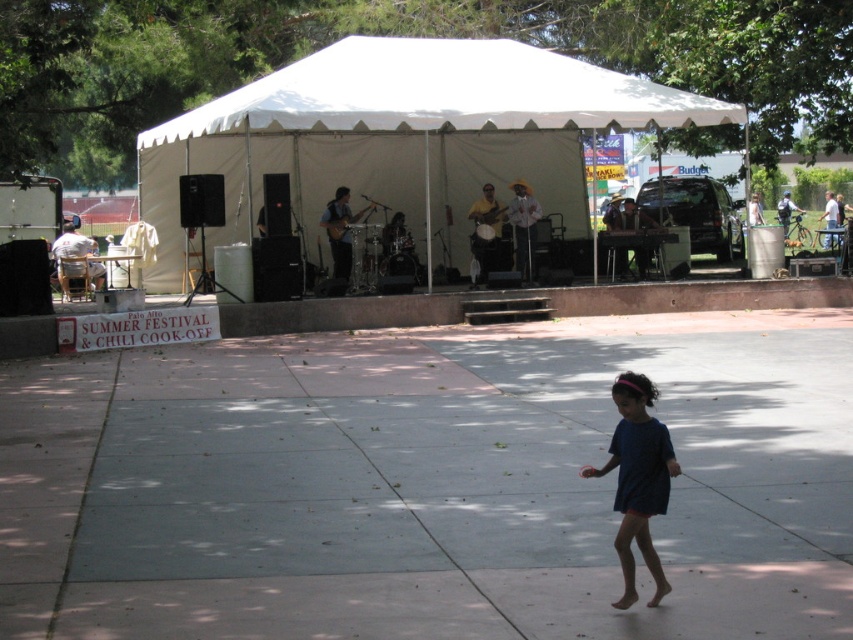
Question: Is white canvas tent at center wider than blue fabric dress at lower center?

Choices:
 (A) no
 (B) yes

Answer: (B)

Question: Does gray concrete pavement at lower center lie in front of white canvas tent at center?

Choices:
 (A) no
 (B) yes

Answer: (B)

Question: Is white canvas tent at center positioned in front of white fabric canopy at upper center?

Choices:
 (A) yes
 (B) no

Answer: (A)

Question: Which of the following is the closest to the observer?

Choices:
 (A) white canvas tent at center
 (B) white fabric canopy at upper center

Answer: (A)

Question: Among these points, which one is farthest from the camera?

Choices:
 (A) (715, 444)
 (B) (235, 177)
 (C) (392, 122)

Answer: (B)

Question: Among these objects, which one is farthest from the camera?

Choices:
 (A) gray concrete pavement at lower center
 (B) blue fabric dress at lower center
 (C) white fabric canopy at upper center

Answer: (C)